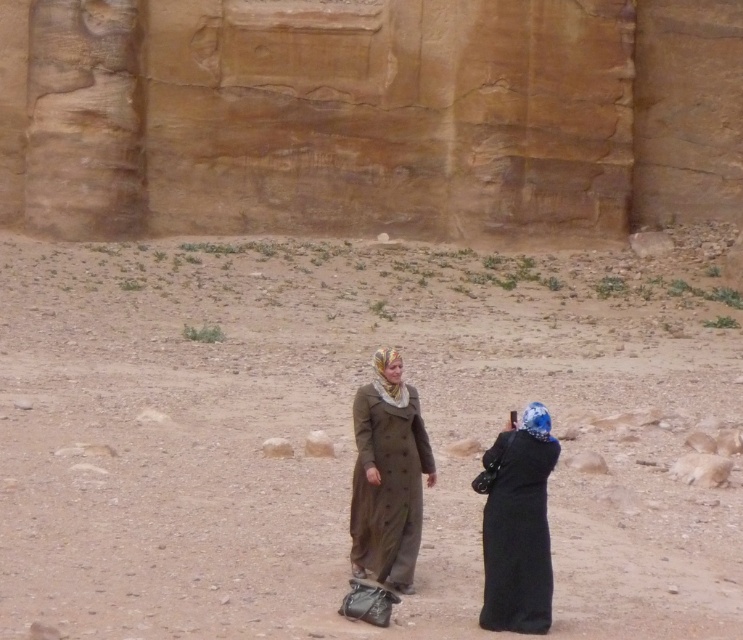
Question: Which point appears farthest from the camera in this image?

Choices:
 (A) (386, 541)
 (B) (655, 604)
 (C) (496, 458)

Answer: (B)

Question: Which of these objects is positioned closest to the black matte coat at center?

Choices:
 (A) matte brown coat at center
 (B) dull brown desert at center

Answer: (A)

Question: Considering the real-world distances, which object is closest to the dull brown desert at center?

Choices:
 (A) black matte coat at center
 (B) matte brown coat at center

Answer: (B)

Question: Considering the relative positions of matte brown coat at center and black matte coat at center in the image provided, where is matte brown coat at center located with respect to black matte coat at center?

Choices:
 (A) above
 (B) below

Answer: (A)

Question: Is dull brown desert at center to the left of matte brown coat at center from the viewer's perspective?

Choices:
 (A) yes
 (B) no

Answer: (A)

Question: Does dull brown desert at center have a larger size compared to matte brown coat at center?

Choices:
 (A) no
 (B) yes

Answer: (B)